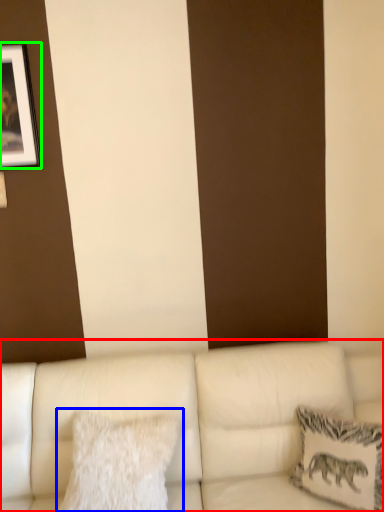
Question: Which object is the farthest from studio couch (highlighted by a red box)? Choose among these: pillow (highlighted by a blue box) or picture frame (highlighted by a green box).

Choices:
 (A) pillow
 (B) picture frame

Answer: (B)